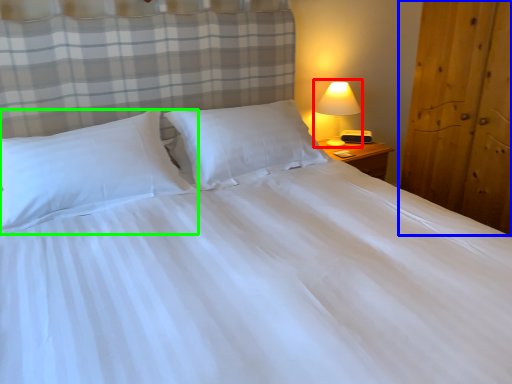
Question: Which object is the farthest from lamp (highlighted by a red box)? Choose among these: armoire (highlighted by a blue box) or pillow (highlighted by a green box).

Choices:
 (A) armoire
 (B) pillow

Answer: (B)